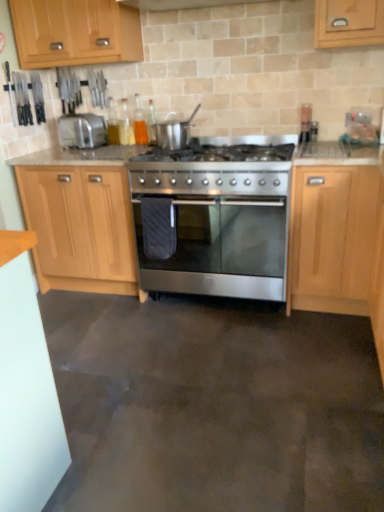
This screenshot has height=512, width=384. In order to click on unoccupied area in front of satin silver pot at center in this screenshot , I will do `click(178, 155)`.